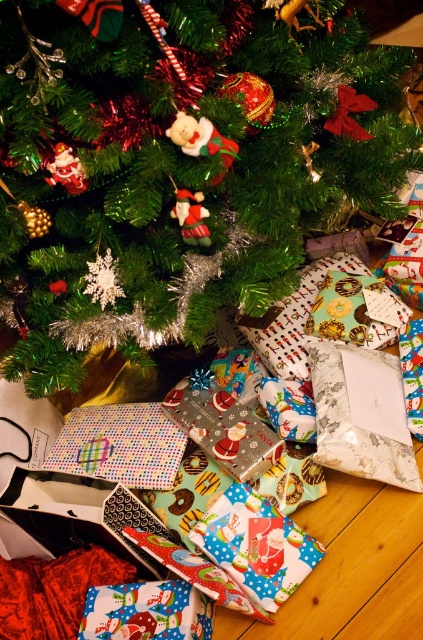
Does point (175, 38) come farther from viewer compared to point (200, 637)?

No, (175, 38) is in front of (200, 637).

Does green matte christmas tree at center have a greater height compared to printed fabric gift at lower left?

Indeed, green matte christmas tree at center has a greater height compared to printed fabric gift at lower left.

At what (x,y) coordinates should I click in order to perform the action: click on green matte christmas tree at center. Please return your answer as a coordinate pair (x, y). The image size is (423, 640). Looking at the image, I should click on (180, 164).

The image size is (423, 640). In order to click on green matte christmas tree at center in this screenshot , I will do `click(180, 164)`.

Is point (323, 205) in front of point (222, 504)?

Yes, point (323, 205) is in front of point (222, 504).

At what (x,y) coordinates should I click in order to perform the action: click on green matte christmas tree at center. Please return your answer as a coordinate pair (x, y). This screenshot has height=640, width=423. Looking at the image, I should click on (180, 164).

Image resolution: width=423 pixels, height=640 pixels. Find the location of `green matte christmas tree at center`. green matte christmas tree at center is located at coordinates (180, 164).

Consider the image. Can you confirm if santa-themed paper at lower center is taller than printed fabric gift at lower left?

Yes.

Looking at this image, is santa-themed paper at lower center shorter than printed fabric gift at lower left?

No.

Find the location of a particular element. Image resolution: width=423 pixels, height=640 pixels. santa-themed paper at lower center is located at coordinates (255, 545).